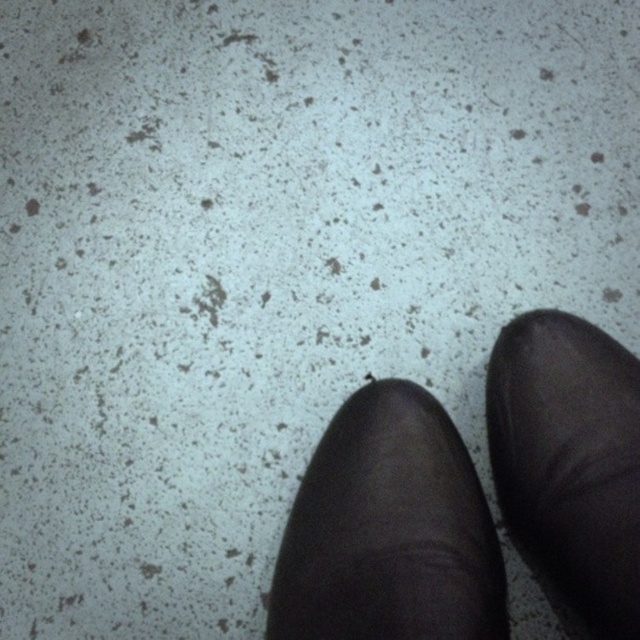
Does black leather shoe at center appear under black leather shoe at lower right?

Indeed, black leather shoe at center is positioned under black leather shoe at lower right.

Locate an element on the screen. This screenshot has height=640, width=640. black leather shoe at center is located at coordinates (388, 531).

You are a GUI agent. You are given a task and a screenshot of the screen. Output one action in this format:
    pyautogui.click(x=<x>, y=<y>)
    Task: Click on the black leather shoe at center
    The image size is (640, 640).
    Given the screenshot: What is the action you would take?
    pyautogui.click(x=388, y=531)